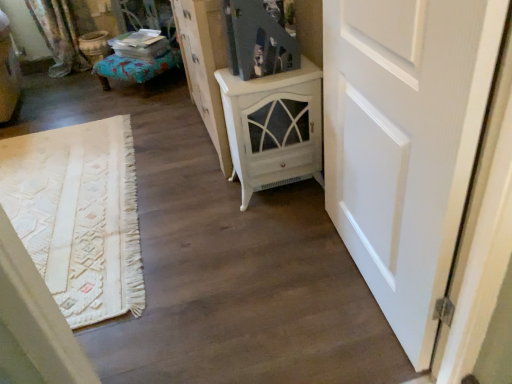
Question: Are white painted wood cabinet at center and white distressed cabinet at center located far from each other?

Choices:
 (A) no
 (B) yes

Answer: (A)

Question: Is white painted wood cabinet at center facing towards white distressed cabinet at center?

Choices:
 (A) no
 (B) yes

Answer: (A)

Question: Is white distressed cabinet at center inside white painted wood cabinet at center?

Choices:
 (A) no
 (B) yes

Answer: (A)

Question: Can you confirm if white painted wood cabinet at center is positioned to the left of white distressed cabinet at center?

Choices:
 (A) yes
 (B) no

Answer: (B)

Question: From a real-world perspective, is white painted wood cabinet at center below white distressed cabinet at center?

Choices:
 (A) yes
 (B) no

Answer: (A)

Question: Is textured teal ottoman at left wider or thinner than white painted wood cabinet at center?

Choices:
 (A) wide
 (B) thin

Answer: (A)

Question: In the image, is textured teal ottoman at left positioned in front of or behind white painted wood cabinet at center?

Choices:
 (A) behind
 (B) front

Answer: (A)

Question: From the image's perspective, relative to white painted wood cabinet at center, is textured teal ottoman at left above or below?

Choices:
 (A) above
 (B) below

Answer: (A)

Question: Is textured teal ottoman at left spatially inside white painted wood cabinet at center, or outside of it?

Choices:
 (A) outside
 (B) inside

Answer: (A)

Question: In terms of width, does white distressed cabinet at center look wider or thinner when compared to white painted wood cabinet at center?

Choices:
 (A) wide
 (B) thin

Answer: (B)

Question: Is point (194, 84) closer or farther from the camera than point (256, 114)?

Choices:
 (A) farther
 (B) closer

Answer: (A)

Question: Considering the positions of white distressed cabinet at center and white painted wood cabinet at center in the image, is white distressed cabinet at center taller or shorter than white painted wood cabinet at center?

Choices:
 (A) tall
 (B) short

Answer: (A)

Question: Based on their sizes in the image, would you say white distressed cabinet at center is bigger or smaller than white painted wood cabinet at center?

Choices:
 (A) big
 (B) small

Answer: (A)

Question: Considering their positions, is white matte door at right located in front of or behind textured teal ottoman at left?

Choices:
 (A) front
 (B) behind

Answer: (A)

Question: Looking at the image, does white matte door at right seem bigger or smaller compared to textured teal ottoman at left?

Choices:
 (A) big
 (B) small

Answer: (A)